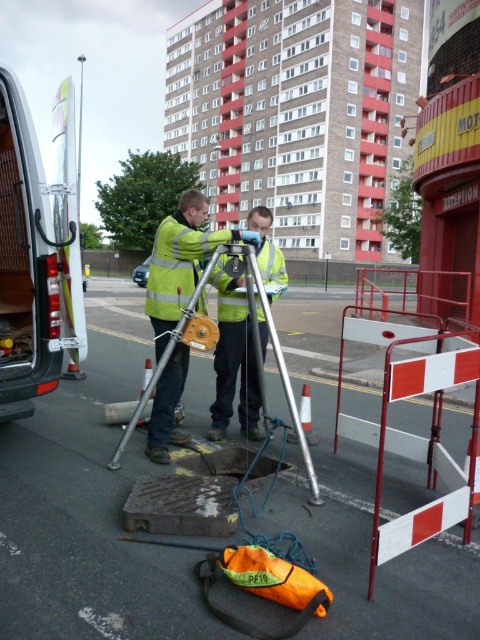
Question: Observing the image, what is the correct spatial positioning of reflective yellow safety vest at center in reference to silver metallic tripod at center?

Choices:
 (A) left
 (B) right

Answer: (B)

Question: Is the position of yellow reflective vest at center less distant than that of reflective yellow safety vest at center?

Choices:
 (A) yes
 (B) no

Answer: (A)

Question: Among these points, which one is nearest to the camera?

Choices:
 (A) (168, 358)
 (B) (268, 244)
 (C) (202, 248)

Answer: (A)

Question: Which of the following is the farthest from the observer?

Choices:
 (A) (147, 300)
 (B) (245, 352)
 (C) (256, 276)

Answer: (B)

Question: Can you confirm if yellow reflective vest at center is smaller than silver metallic tripod at center?

Choices:
 (A) yes
 (B) no

Answer: (B)

Question: Which point is closer to the camera?

Choices:
 (A) (286, 396)
 (B) (229, 396)

Answer: (A)